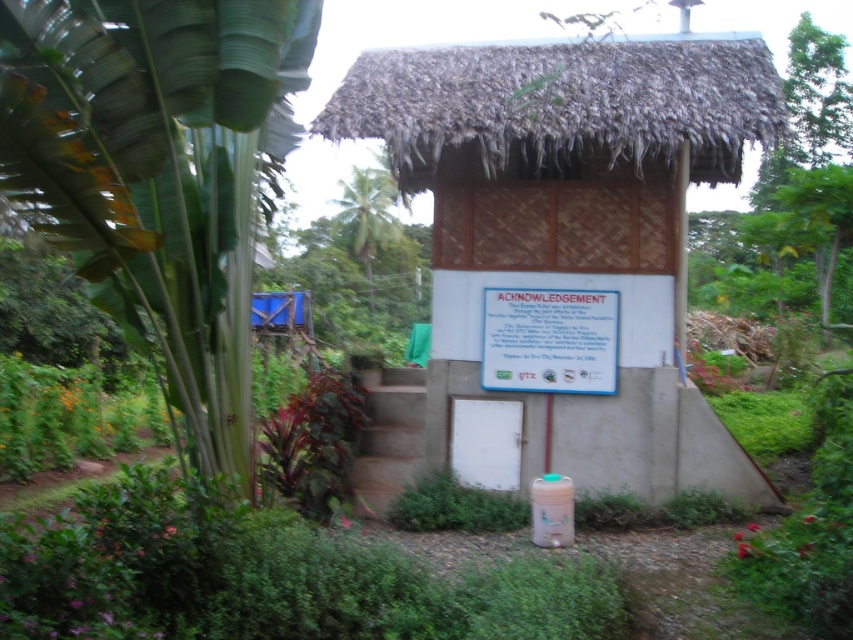
You are a visitor standing in front of the thatched roof hut at center and the white paper at center. You want to place a small flower pot between them. Which object should you place it closer to to ensure it fits within the space between them?

The thatched roof hut at center is wider than the white paper at center. Therefore, you should place the flower pot closer to the white paper at center to ensure it fits within the space between them.

You are a visitor standing in front of the thatched roof hut at center and the white paper at center. Which object is taller?

The thatched roof hut at center is taller than the white paper at center.